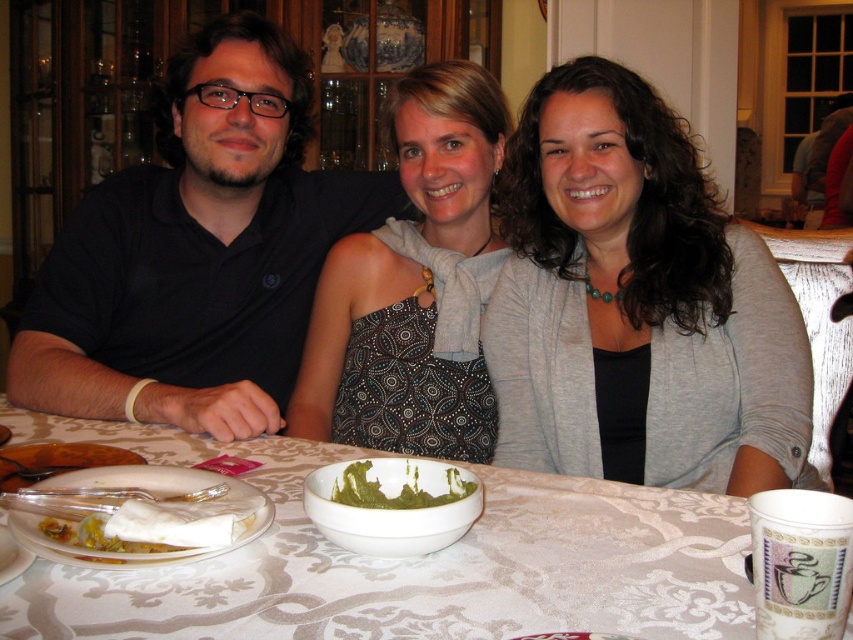
Between gray knit cardigan at center and white ceramic plate at lower left, which one has less height?

With less height is white ceramic plate at lower left.

Is gray knit cardigan at center positioned at the back of white ceramic plate at lower left?

Yes.

Locate an element on the screen. gray knit cardigan at center is located at coordinates (637, 305).

Image resolution: width=853 pixels, height=640 pixels. What do you see at coordinates (637, 305) in the screenshot?
I see `gray knit cardigan at center` at bounding box center [637, 305].

Does point (787, 416) come in front of point (344, 484)?

No.

The image size is (853, 640). I want to click on gray knit cardigan at center, so click(x=637, y=305).

Where is `gray knit cardigan at center`? The image size is (853, 640). gray knit cardigan at center is located at coordinates (637, 305).

Looking at this image, can you confirm if matte black shirt at left is positioned above white ceramic plate at lower left?

Yes.

Is matte black shirt at left smaller than white ceramic plate at lower left?

Incorrect, matte black shirt at left is not smaller in size than white ceramic plate at lower left.

Find the location of a particular element. matte black shirt at left is located at coordinates (665, 380).